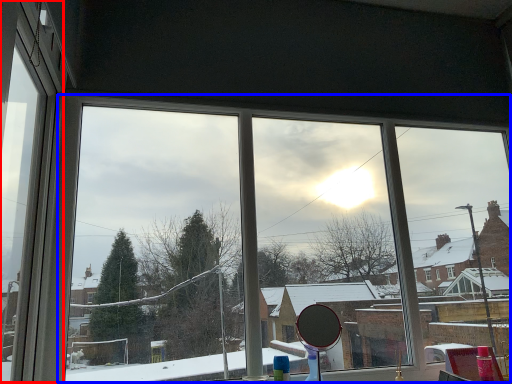
Question: Which of the following is the farthest to the observer, window frame (highlighted by a red box) or bay window (highlighted by a blue box)?

Choices:
 (A) window frame
 (B) bay window

Answer: (B)